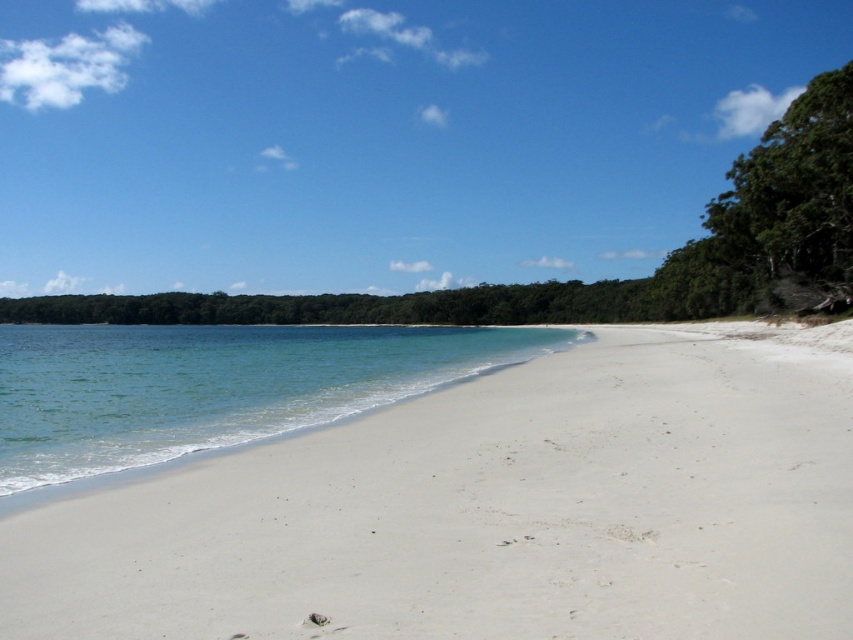
Is point (358, 531) more distant than point (292, 406)?

No, it is in front of (292, 406).

Which is below, white sandy beach at center or clear water at lower left?

Positioned lower is white sandy beach at center.

The height and width of the screenshot is (640, 853). What are the coordinates of `white sandy beach at center` in the screenshot? It's located at (486, 513).